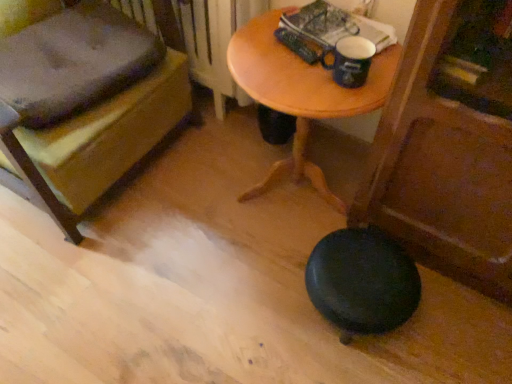
The image size is (512, 384). I want to click on vacant area to the left of blue ceramic mug at upper center, so click(284, 75).